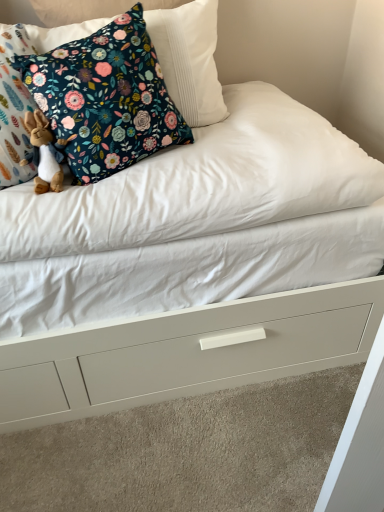
Question: Is floral fabric pillow at upper left in front of or behind brown plush rabbit at left in the image?

Choices:
 (A) front
 (B) behind

Answer: (A)

Question: Considering the relative positions of floral fabric pillow at upper left and brown plush rabbit at left in the image provided, is floral fabric pillow at upper left to the left or to the right of brown plush rabbit at left?

Choices:
 (A) right
 (B) left

Answer: (A)

Question: Which object is positioned farthest from the floral fabric pillow at upper left?

Choices:
 (A) brown plush rabbit at left
 (B) white matte drawer at center

Answer: (B)

Question: Estimate the real-world distances between objects in this image. Which object is closer to the floral fabric pillow at upper left?

Choices:
 (A) white matte drawer at center
 (B) brown plush rabbit at left

Answer: (B)